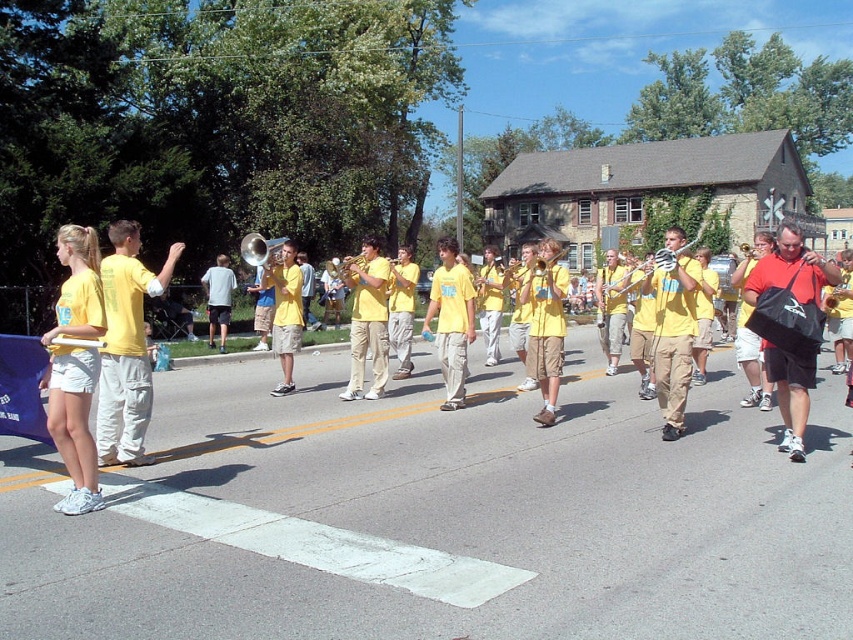
Question: Estimate the real-world distances between objects in this image. Which object is farther from the light yellow t-shirt at left?

Choices:
 (A) yellow matte t-shirt at left
 (B) yellow matte uniform at left
 (C) khaki pants at center

Answer: (C)

Question: Is light yellow t-shirt at left bigger than yellow matte uniform at center?

Choices:
 (A) yes
 (B) no

Answer: (B)

Question: Where is yellow matte t-shirt at left located in relation to khaki pants at center in the image?

Choices:
 (A) below
 (B) above

Answer: (B)

Question: Does yellow matte uniform at left lie in front of yellow matte t-shirt at left?

Choices:
 (A) yes
 (B) no

Answer: (A)

Question: Which object is farther from the camera taking this photo?

Choices:
 (A) yellow matte t-shirt at left
 (B) yellow matte uniform at left
 (C) yellow matte uniform at center

Answer: (C)

Question: Which of the following is the closest to the observer?

Choices:
 (A) (672, 385)
 (B) (88, 307)
 (C) (123, 401)

Answer: (B)